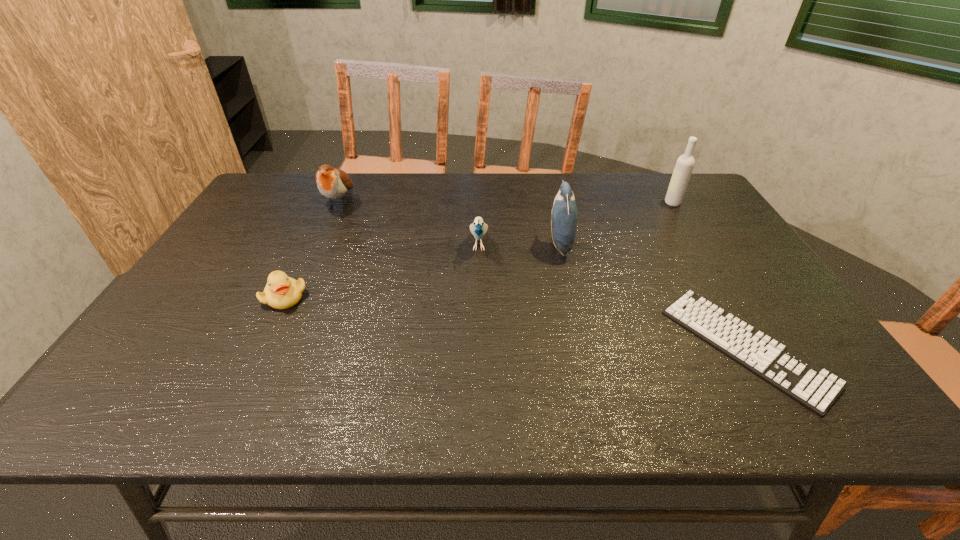
Where is `object that is at the far right corner`? Image resolution: width=960 pixels, height=540 pixels. object that is at the far right corner is located at coordinates pos(684,166).

Locate an element on the screen. The width and height of the screenshot is (960, 540). object located in the near right corner section of the desktop is located at coordinates (815, 388).

In the image, there is a desktop. Where is `vacant space at the far edge`? vacant space at the far edge is located at coordinates (512, 183).

In the image, there is a desktop. Find the location of `vacant space at the near edge`. vacant space at the near edge is located at coordinates (376, 394).

You are a GUI agent. You are given a task and a screenshot of the screen. Output one action in this format:
    pyautogui.click(x=<x>, y=<y>)
    Task: Click on the vacant space at the left edge
    The image size is (960, 540).
    Given the screenshot: What is the action you would take?
    pyautogui.click(x=137, y=367)

The width and height of the screenshot is (960, 540). I want to click on blank space at the right edge, so click(689, 241).

Locate an element on the screen. The height and width of the screenshot is (540, 960). blank space at the far left corner of the desktop is located at coordinates (257, 208).

Where is `free space at the far right corner`? This screenshot has width=960, height=540. free space at the far right corner is located at coordinates (708, 199).

In the image, there is a desktop. Where is `vacant region at the near right corner`? vacant region at the near right corner is located at coordinates (843, 397).

Where is `vacant point located between the fourth object from left to right and the leftmost bird`? The image size is (960, 540). vacant point located between the fourth object from left to right and the leftmost bird is located at coordinates (449, 224).